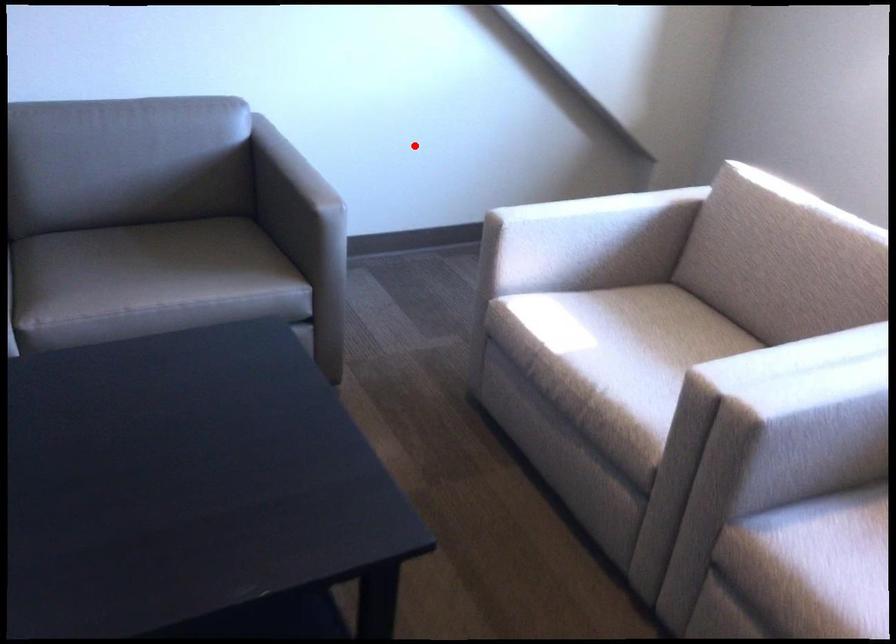
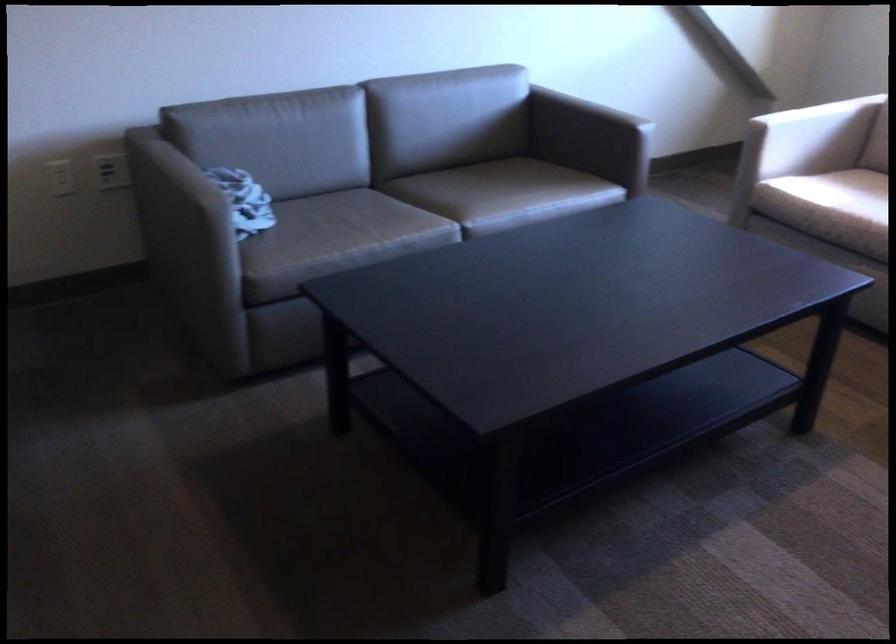
Question: A red point is marked in image1. In image2, is the corresponding 3D point closer to the camera or farther? Reply with the corresponding letter.

Choices:
 (A) The corresponding 3D point is closer.
 (B) The corresponding 3D point is farther.

Answer: (B)